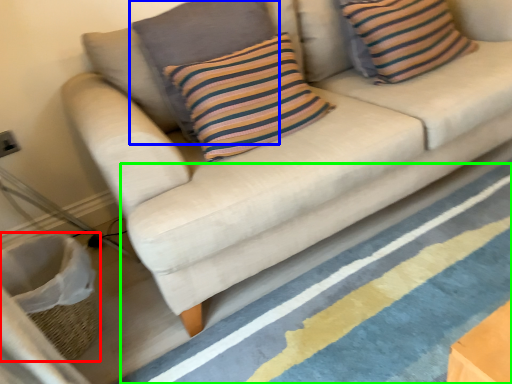
Question: Considering the real-world distances, which object is farthest from basket (highlighted by a red box)? pillow (highlighted by a blue box) or stripe (highlighted by a green box)?

Choices:
 (A) pillow
 (B) stripe

Answer: (A)